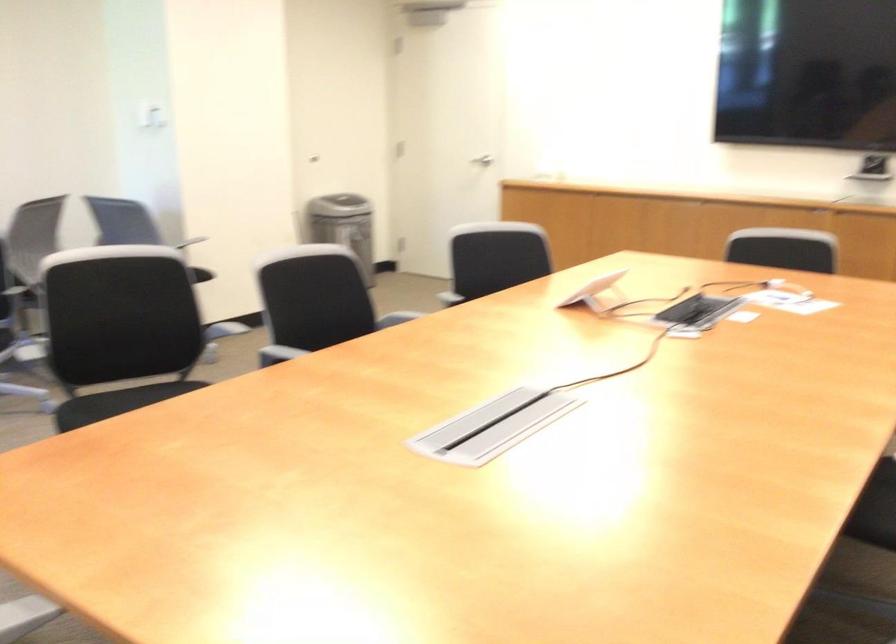
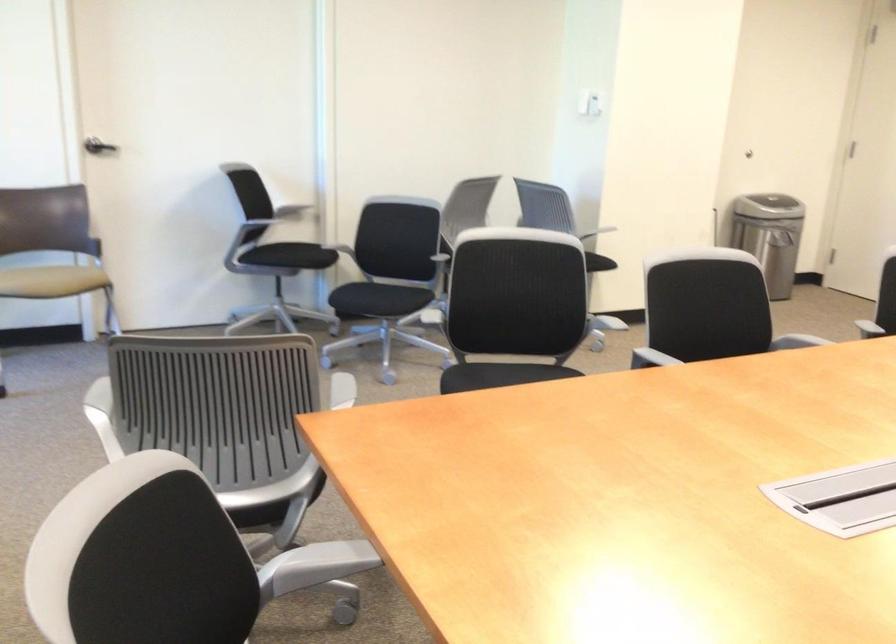
The images are taken continuously from a first-person perspective. In which direction are you moving?

The cameraman walked toward right, forward.